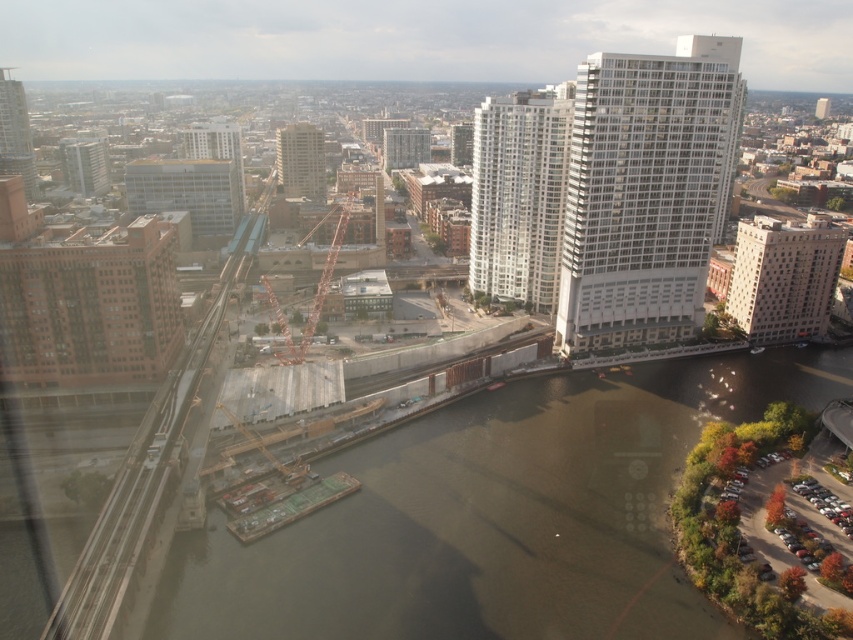
You are a city planner reviewing an aerial map of the urban area. You need to place a new construction site at point (x=312, y=296). The current map shows an orange metallic crane at center. Is there enough space to place the new construction site there?

The orange metallic crane at center is already located at point (x=312, y=296), so placing a new construction site there would require removing or relocating the existing crane.

You are a city planner assessing the distance between the orange metallic crane at center and the matte gray building at upper left for a new pedestrian bridge project. The minimum required distance for safety regulations is 200 meters. Based on the information provided, will the proposed bridge between these two points meet the safety requirements?

The orange metallic crane at center and the matte gray building at upper left are 195.56 meters apart, which is less than the required 200 meters for safety regulations. Therefore, the proposed bridge between these two points will not meet the safety requirements.

You are a drone operator trying to deliver a package to a specific location marked by the point at coordinates (500, 205) in this urban area. The drone has a maximum flight range of 800 feet. Based on the scene, can the drone reach the destination without running out of battery?

The point at coordinates (500, 205) is 781.70 feet away from the camera, so yes, the drone can reach the destination as the distance is within its 800 feet maximum range.